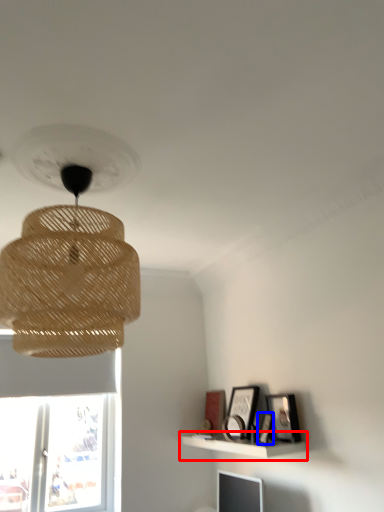
Question: Among these objects, which one is nearest to the camera, shelf (highlighted by a red box) or picture frame (highlighted by a blue box)?

Choices:
 (A) shelf
 (B) picture frame

Answer: (A)